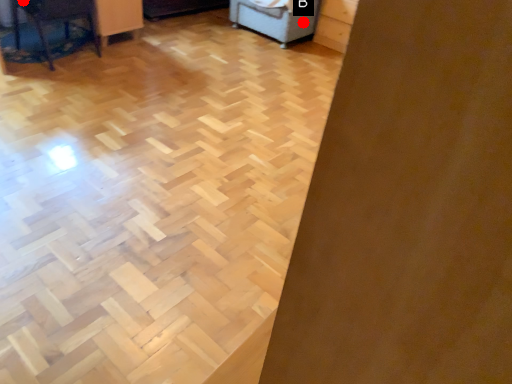
Question: Two points are circled on the image, labeled by A and B beside each circle. Which point is closer to the camera?

Choices:
 (A) A is closer
 (B) B is closer

Answer: (A)